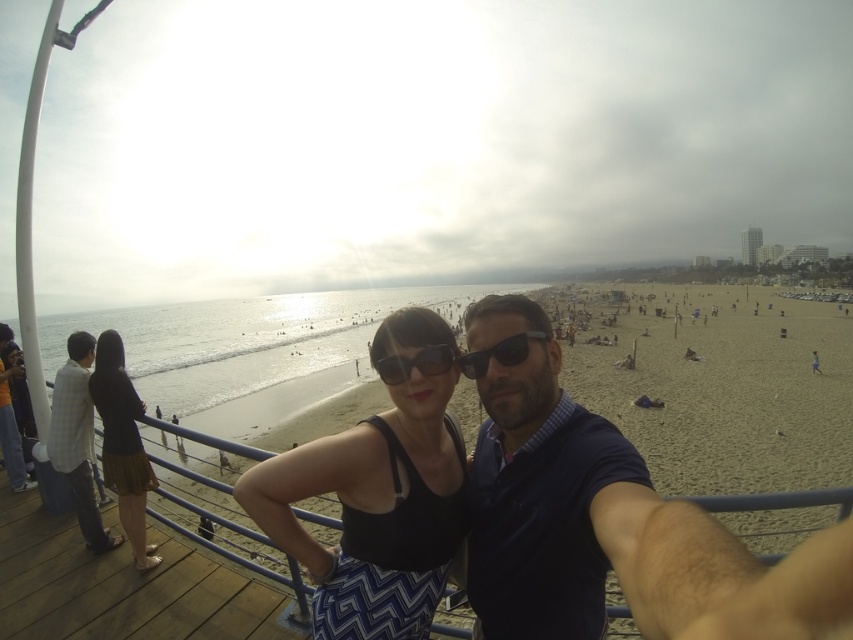
You are standing on the wooden pier and want to take a photo of both the beige sand beach at center and the dark blue polo shirt at center. Which object should you focus on first to ensure both are in the frame?

You should focus on the beige sand beach at center first because the dark blue polo shirt at center is behind it, so adjusting the frame to include the foreground beach will naturally include the background shirt.

You are a photographer trying to capture the entire scene of the beige sand beach at center and the dark blue polo shirt at center in one photo. Which object will occupy more space in the photo?

The beige sand beach at center is bigger than the dark blue polo shirt at center, so it will occupy more space in the photo.